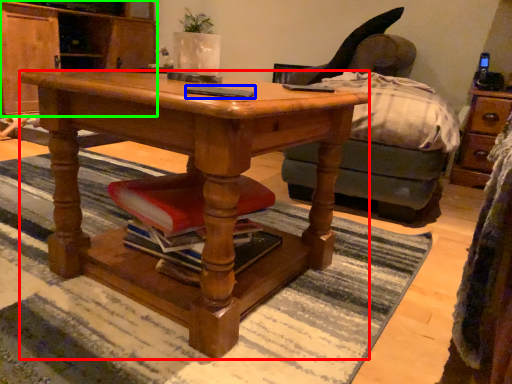
Question: Which object is the farthest from desk (highlighted by a red box)? Choose among these: mobile phone (highlighted by a blue box) or cabinetry (highlighted by a green box).

Choices:
 (A) mobile phone
 (B) cabinetry

Answer: (B)